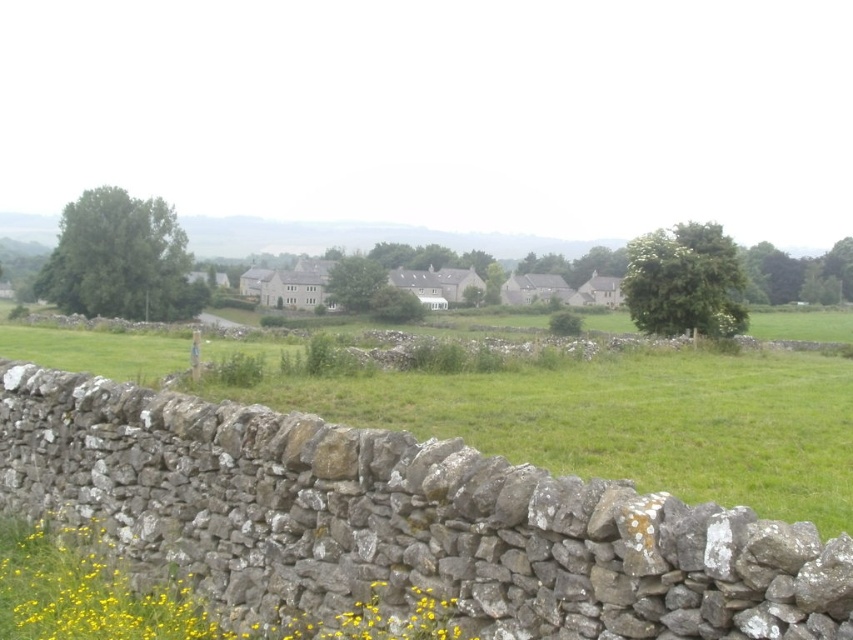
Question: Observing the image, what is the correct spatial positioning of green grassy field at center in reference to yellow grass at lower left?

Choices:
 (A) left
 (B) right

Answer: (A)

Question: Which object is closer to the camera taking this photo?

Choices:
 (A) green grassy field at center
 (B) yellow grass at lower left

Answer: (B)

Question: Considering the relative positions of green grassy field at center and yellow grass at lower left in the image provided, where is green grassy field at center located with respect to yellow grass at lower left?

Choices:
 (A) left
 (B) right

Answer: (A)

Question: Does green grassy field at center appear on the right side of yellow grass at lower left?

Choices:
 (A) no
 (B) yes

Answer: (A)

Question: Which point is farther to the camera?

Choices:
 (A) yellow grass at lower left
 (B) green grassy field at center

Answer: (B)